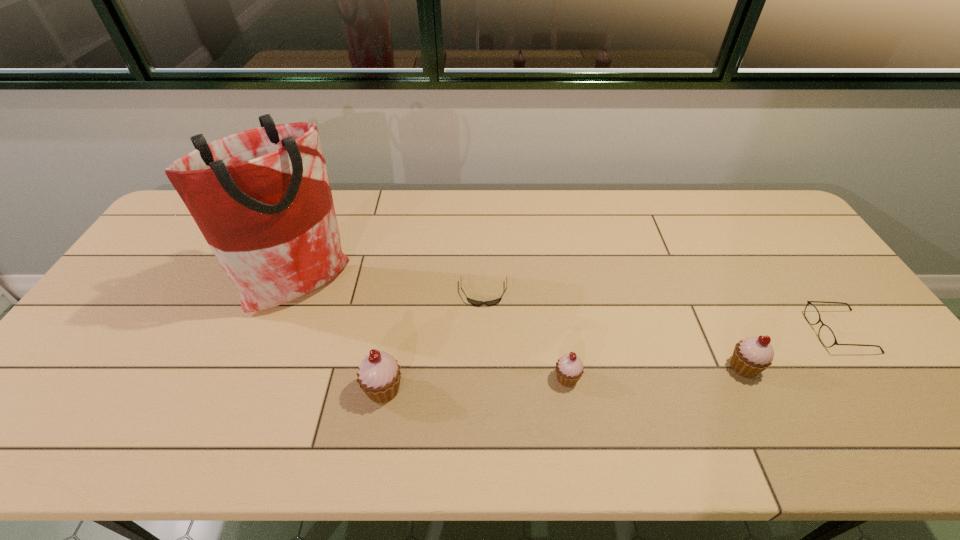
Where is `free spot between the second object from left to right and the rightmost object`? The height and width of the screenshot is (540, 960). free spot between the second object from left to right and the rightmost object is located at coordinates (612, 360).

Locate an element on the screen. free spot between the shortest object and the grocery bag is located at coordinates (394, 291).

This screenshot has width=960, height=540. In order to click on empty location between the second shortest cupcake and the sunglasses in this screenshot , I will do `click(613, 330)`.

This screenshot has height=540, width=960. Identify the location of free space between the rightmost cupcake and the fourth object from left to right. (656, 373).

At what (x,y) coordinates should I click in order to perform the action: click on blank region between the grocery bag and the sunglasses. Please return your answer as a coordinate pair (x, y). Looking at the image, I should click on (394, 291).

Identify which object is located as the fifth nearest to the fourth object from right to left. Please provide its 2D coordinates. Your answer should be formatted as a tuple, i.e. [(x, y)], where the tuple contains the x and y coordinates of a point satisfying the conditions above.

[(826, 336)]

Where is `object identified as the second closest to the sunglasses`? This screenshot has width=960, height=540. object identified as the second closest to the sunglasses is located at coordinates (379, 375).

Find the location of a particular element. The width and height of the screenshot is (960, 540). cupcake that is the closest to the fifth tallest object is located at coordinates (751, 356).

Locate which cupcake ranks second in proximity to the spectacles. Please provide its 2D coordinates. Your answer should be formatted as a tuple, i.e. [(x, y)], where the tuple contains the x and y coordinates of a point satisfying the conditions above.

[(569, 369)]

You are a GUI agent. You are given a task and a screenshot of the screen. Output one action in this format:
    pyautogui.click(x=<x>, y=<y>)
    Task: Click on the free space that satisfies the following two spatial constraints: 1. on the front-facing side of the spectacles; 2. on the front side of the shortest cupcake
    The width and height of the screenshot is (960, 540).
    Given the screenshot: What is the action you would take?
    pyautogui.click(x=873, y=378)